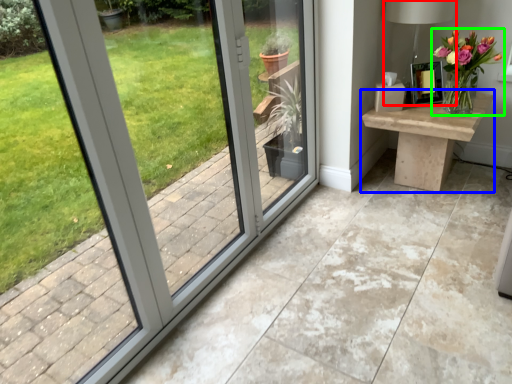
Question: Which object is the farthest from table lamp (highlighted by a red box)? Choose among these: table (highlighted by a blue box) or houseplant (highlighted by a green box).

Choices:
 (A) table
 (B) houseplant

Answer: (A)